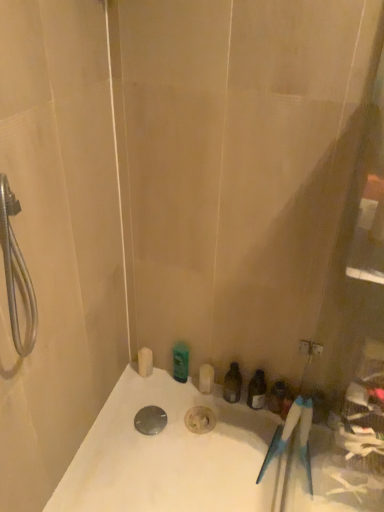
You are a GUI agent. You are given a task and a screenshot of the screen. Output one action in this format:
    pyautogui.click(x=<x>, y=<y>)
    Task: Click on the vacant space that's between translucent plastic bottle at center, acting as the 3th toiletry starting from the left, and white matte soap dispenser at lower left, arranged as the 4th toiletry when viewed from the right
    This screenshot has height=512, width=384.
    Given the screenshot: What is the action you would take?
    pyautogui.click(x=184, y=390)